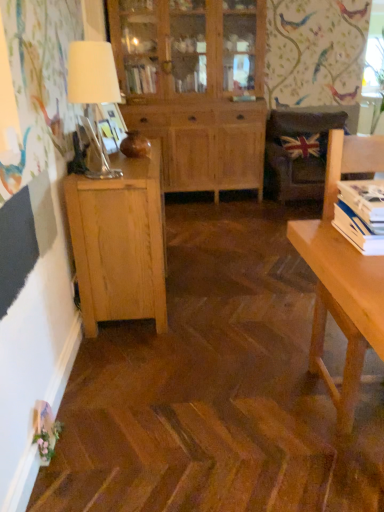
Identify the location of vacant area situated below matte white lampshade at left (from a real-world perspective). (91, 177).